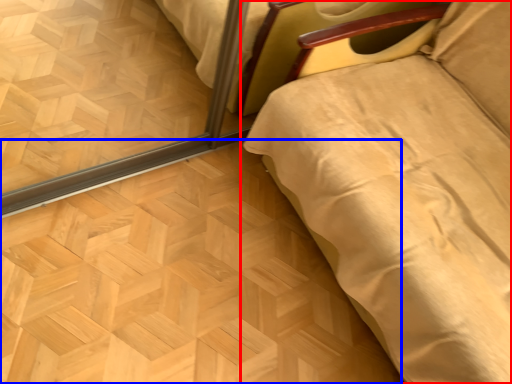
Question: Which object appears farthest to the camera in this image, furniture (highlighted by a red box) or plywood (highlighted by a blue box)?

Choices:
 (A) furniture
 (B) plywood

Answer: (B)